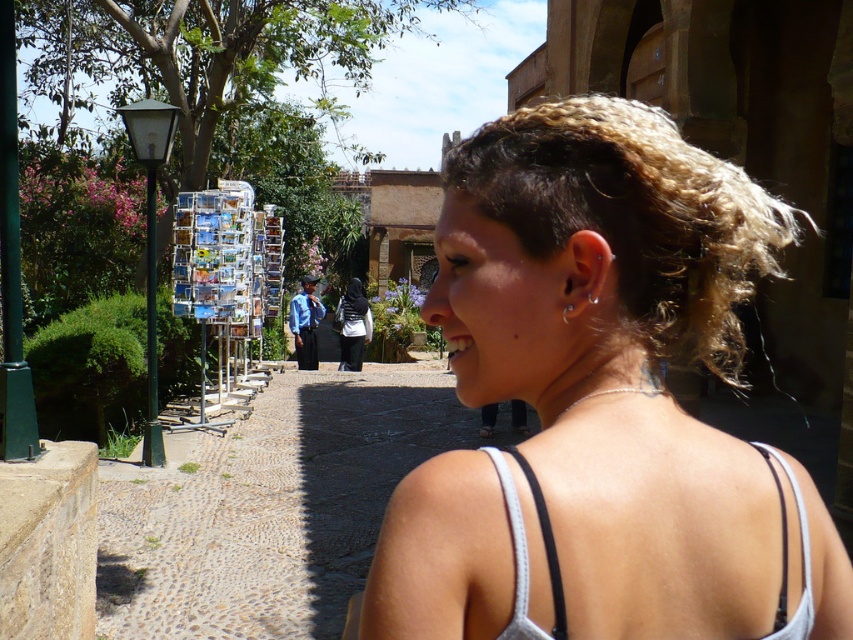
Is point (660, 536) behind point (354, 328)?

No.

Which is behind, point (370, 621) or point (347, 333)?

The point (347, 333) is behind.

Is point (376, 609) in front of point (363, 308)?

Yes, point (376, 609) is closer to viewer.

The image size is (853, 640). I want to click on blonde hair at upper right, so click(602, 403).

Is point (705, 192) closer to camera compared to point (567, 310)?

No, (705, 192) is behind (567, 310).

The image size is (853, 640). What do you see at coordinates (634, 216) in the screenshot?
I see `blonde curly hair at upper right` at bounding box center [634, 216].

Is point (515, 212) in front of point (569, 308)?

No, it is not.

This screenshot has width=853, height=640. In order to click on blonde curly hair at upper right in this screenshot , I will do `click(634, 216)`.

This screenshot has height=640, width=853. Describe the element at coordinates (352, 326) in the screenshot. I see `black fabric hijab at center` at that location.

Which is in front, point (357, 321) or point (563, 308)?

Positioned in front is point (563, 308).

You are a GUI agent. You are given a task and a screenshot of the screen. Output one action in this format:
    pyautogui.click(x=<x>, y=<y>)
    Task: Click on the black fabric hijab at center
    Image resolution: width=853 pixels, height=640 pixels.
    Given the screenshot: What is the action you would take?
    pyautogui.click(x=352, y=326)